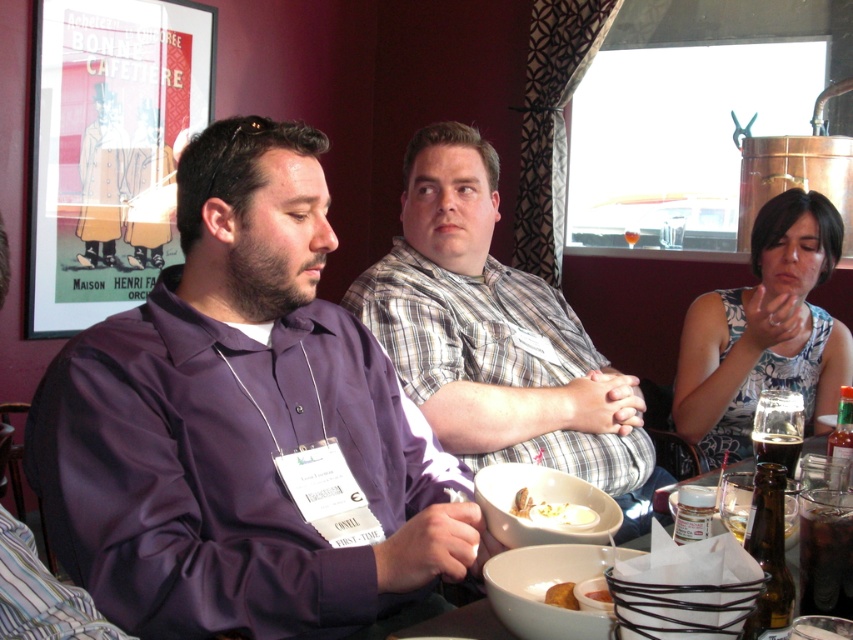
Question: Can you confirm if purple satin shirt at center is smaller than brown glass bottle at lower right?

Choices:
 (A) no
 (B) yes

Answer: (A)

Question: Considering the real-world distances, which object is farthest from the white floral dress at upper right?

Choices:
 (A) smooth yellow bread at lower center
 (B) purple smooth shirt at center
 (C) brown glass bottle at lower right
 (D) white ceramic bowls at center

Answer: (A)

Question: Among these points, which one is farthest from the camera?

Choices:
 (A) (424, 252)
 (B) (590, 589)
 (C) (656, 508)

Answer: (A)

Question: Can you confirm if purple satin shirt at center is positioned to the right of smooth yellow bread at lower center?

Choices:
 (A) yes
 (B) no

Answer: (B)

Question: Is white ceramic bowls at center below white creamy bowl at lower center?

Choices:
 (A) no
 (B) yes

Answer: (B)

Question: Which of the following is the farthest from the observer?

Choices:
 (A) purple satin shirt at center
 (B) white ceramic bowls at center
 (C) smooth yellow bread at lower center

Answer: (B)